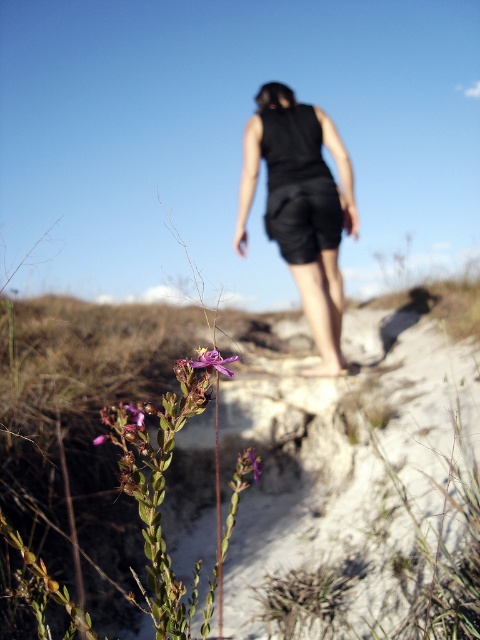
Does black matte shorts at center appear on the right side of purple matte flower at lower left?

Correct, you'll find black matte shorts at center to the right of purple matte flower at lower left.

Can you confirm if black matte shorts at center is taller than purple matte flower at lower left?

Yes.

Image resolution: width=480 pixels, height=640 pixels. Find the location of `black matte shorts at center`. black matte shorts at center is located at coordinates (301, 208).

Between purple matte flower at lower left and purple matte flower at center, which one appears on the left side from the viewer's perspective?

From the viewer's perspective, purple matte flower at lower left appears more on the left side.

Consider the image. Is purple matte flower at lower left bigger than purple matte flower at center?

Actually, purple matte flower at lower left might be smaller than purple matte flower at center.

Where is `purple matte flower at lower left`? purple matte flower at lower left is located at coordinates (213, 360).

Who is higher up, black matte shorts at center or purple matte flower at center?

black matte shorts at center is above.

Is black matte shorts at center taller than purple matte flower at center?

Yes, black matte shorts at center is taller than purple matte flower at center.

The image size is (480, 640). Describe the element at coordinates (301, 208) in the screenshot. I see `black matte shorts at center` at that location.

The width and height of the screenshot is (480, 640). I want to click on black matte shorts at center, so click(x=301, y=208).